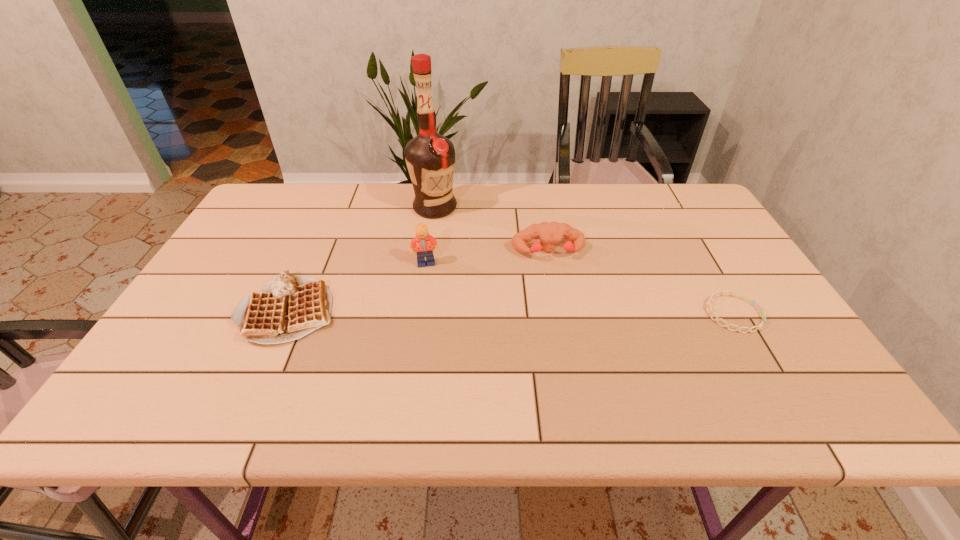
Find the location of a particular element. vacant spot on the desktop that is between the leftmost object and the bracelet and is positioned on the front and back of the tallest object is located at coordinates (478, 312).

This screenshot has width=960, height=540. I want to click on vacant spot on the desktop that is between the waffle and the rightmost object and is positioned with the gloves of the third shortest object facing forward, so coord(564,313).

Where is `free space on the desktop that is between the second shortest object and the shortest object and is positioned on the front-facing side of the Lego`? The width and height of the screenshot is (960, 540). free space on the desktop that is between the second shortest object and the shortest object and is positioned on the front-facing side of the Lego is located at coordinates (462, 312).